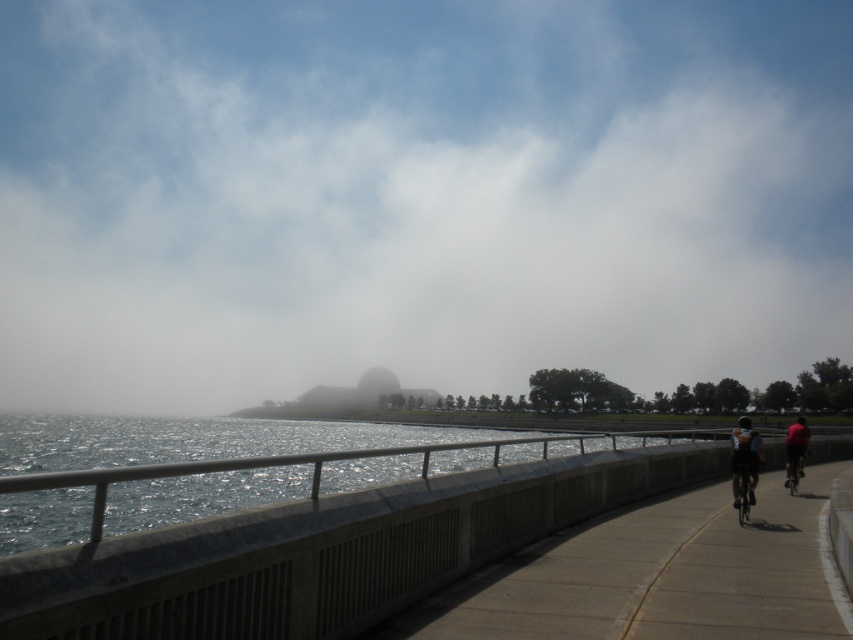
Who is shorter, foggy atmosphere at upper center or dark blue fabric cyclist at right?

Standing shorter between the two is dark blue fabric cyclist at right.

This screenshot has width=853, height=640. Find the location of `foggy atmosphere at upper center`. foggy atmosphere at upper center is located at coordinates (416, 196).

Measure the distance between foggy atmosphere at upper center and camera.

foggy atmosphere at upper center and camera are 173.87 meters apart from each other.

Image resolution: width=853 pixels, height=640 pixels. Find the location of `foggy atmosphere at upper center`. foggy atmosphere at upper center is located at coordinates (416, 196).

Does foggy atmosphere at upper center have a greater width compared to metallic silver bicycle at right?

Yes, foggy atmosphere at upper center is wider than metallic silver bicycle at right.

Does foggy atmosphere at upper center appear on the left side of metallic silver bicycle at right?

Indeed, foggy atmosphere at upper center is positioned on the left side of metallic silver bicycle at right.

Identify the location of foggy atmosphere at upper center. The image size is (853, 640). (416, 196).

Is foggy atmosphere at upper center smaller than black matte bicycle at center-right?

No, foggy atmosphere at upper center is not smaller than black matte bicycle at center-right.

Does foggy atmosphere at upper center appear on the right side of black matte bicycle at center-right?

Incorrect, foggy atmosphere at upper center is not on the right side of black matte bicycle at center-right.

Based on the photo, who is more forward, (801, 200) or (746, 483)?

Positioned in front is point (746, 483).

Identify the location of foggy atmosphere at upper center. (416, 196).